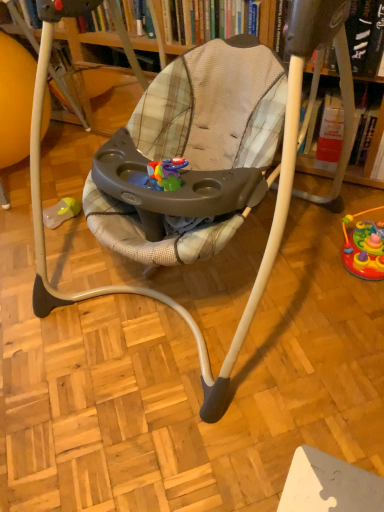
The width and height of the screenshot is (384, 512). What are the coordinates of `free space in front of rubberized plastic toy at lower right` in the screenshot? It's located at (354, 311).